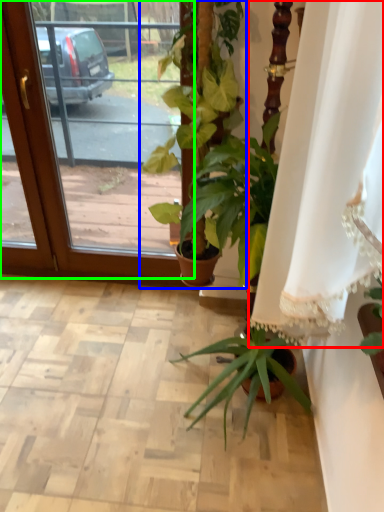
Question: Considering the real-world distances, which object is closest to curtain (highlighted by a red box)? houseplant (highlighted by a blue box) or screen door (highlighted by a green box).

Choices:
 (A) houseplant
 (B) screen door

Answer: (A)